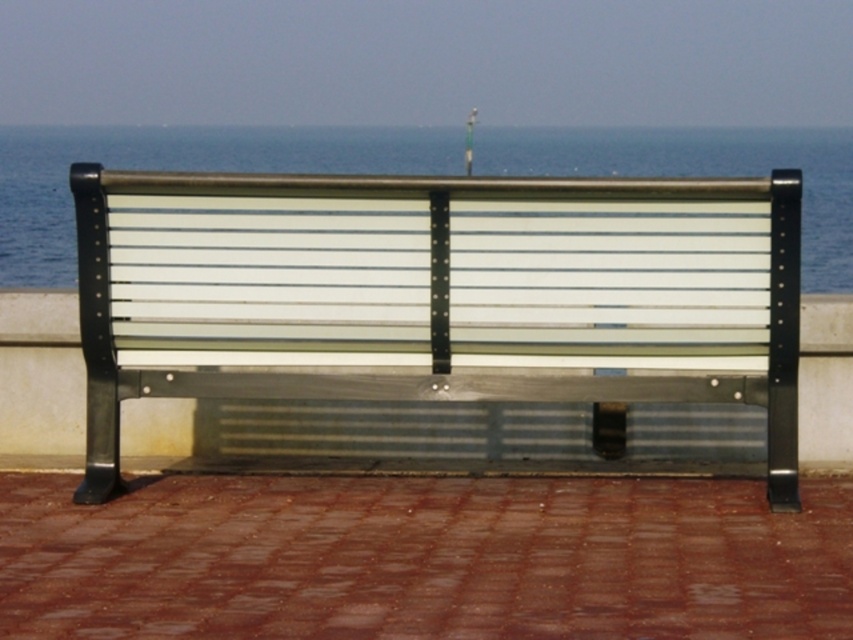
You are a pedestrian walking towards the metallic silver bench at center. You notice transparent glass water at upper center in the distance. Which object will you encounter first as you approach the bench?

You will encounter the metallic silver bench at center first because the transparent glass water at upper center is located behind it.

You are designing a new outdoor seating area and want to place a bench similar to the metallic silver bench at center next to a water feature with transparent glass water at upper center. Based on the scene, will the bench fit comfortably next to the water feature if the water feature is wider than the bench?

The metallic silver bench at center is narrower than the transparent glass water at upper center, so placing the bench next to the water feature would be feasible as the bench is narrower and would not obstruct the water feature.